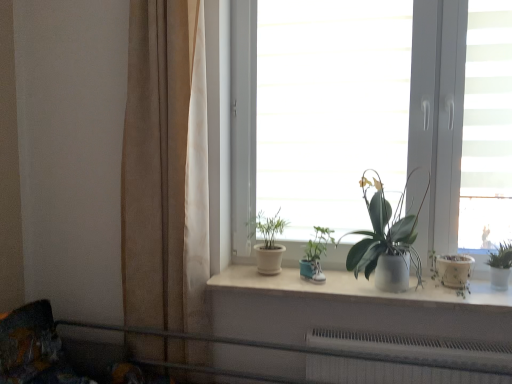
What do you see at coordinates (316, 255) in the screenshot? I see `teal fabric shoe at center, which is the 2th houseplant from left to right` at bounding box center [316, 255].

You are a GUI agent. You are given a task and a screenshot of the screen. Output one action in this format:
    pyautogui.click(x=<x>, y=<y>)
    Task: Click on the matte white pot at center, marked as the fourth houseplant in a right-to-left arrangement
    This screenshot has width=512, height=384.
    Given the screenshot: What is the action you would take?
    pyautogui.click(x=268, y=242)

What do you see at coordinates (500, 266) in the screenshot?
I see `green glossy plant at right, which ranks as the first houseplant in right-to-left order` at bounding box center [500, 266].

In order to face green glossy plant at right, which ranks as the 4th houseplant in left-to-right order, should I rotate leftwards or rightwards?

You should rotate right by 30.154 degrees.

Locate an element on the screen. This screenshot has width=512, height=384. white matte window sill at center is located at coordinates (355, 287).

What do you see at coordinates (355, 287) in the screenshot?
I see `white matte window sill at center` at bounding box center [355, 287].

I want to click on white matte window at center, so click(387, 117).

Locate an element on the screen. The width and height of the screenshot is (512, 384). teal fabric shoe at center, which is the 3th houseplant in right-to-left order is located at coordinates (316, 255).

Is white matte window at center further to camera compared to green glossy plant at right, which ranks as the 4th houseplant in left-to-right order?

That is True.

Is white matte window at center facing towards green glossy plant at right, which ranks as the 4th houseplant in left-to-right order?

Yes, white matte window at center is oriented towards green glossy plant at right, which ranks as the 4th houseplant in left-to-right order.

Can you confirm if white matte window at center is thinner than green glossy plant at right, which ranks as the first houseplant in right-to-left order?

No, white matte window at center is not thinner than green glossy plant at right, which ranks as the first houseplant in right-to-left order.

Does point (288, 17) appear closer or farther from the camera than point (499, 254)?

Point (288, 17) is farther from the camera than point (499, 254).

Is metallic gray rail at lower center taller than white matte window sill at center?

Yes.

Is point (262, 343) farther from camera compared to point (254, 282)?

No.

Based on the photo, is metallic gray rail at lower center inside or outside of white matte window sill at center?

metallic gray rail at lower center is not enclosed by white matte window sill at center.

How distant is teal fabric shoe at center, which is the 3th houseplant in right-to-left order, from white matte window sill at center?

teal fabric shoe at center, which is the 3th houseplant in right-to-left order, is 7.82 inches away from white matte window sill at center.

Is teal fabric shoe at center, which is the 3th houseplant in right-to-left order, looking in the opposite direction of white matte window sill at center?

No, white matte window sill at center is not at the back of teal fabric shoe at center, which is the 3th houseplant in right-to-left order.

Looking at this image, is the surface of teal fabric shoe at center, which is the 2th houseplant from left to right, in direct contact with white matte window sill at center?

teal fabric shoe at center, which is the 2th houseplant from left to right, and white matte window sill at center are not in contact.

Visually, is burlap curtain at left positioned to the left or to the right of green glossy plant at right, which ranks as the 4th houseplant in left-to-right order?

burlap curtain at left is positioned on green glossy plant at right, which ranks as the 4th houseplant in left-to-right order,'s left side.

Can you tell me how much burlap curtain at left and green glossy plant at right, which ranks as the 4th houseplant in left-to-right order, differ in facing direction?

0.186 degrees separate the facing orientations of burlap curtain at left and green glossy plant at right, which ranks as the 4th houseplant in left-to-right order.

Between burlap curtain at left and green glossy plant at right, which ranks as the first houseplant in right-to-left order, which one has more height?

Standing taller between the two is burlap curtain at left.

From a real-world perspective, is burlap curtain at left located higher than green glossy plant at right, which ranks as the 4th houseplant in left-to-right order?

Yes, from a real-world perspective, burlap curtain at left is above green glossy plant at right, which ranks as the 4th houseplant in left-to-right order.

Is the surface of green glossy plant at right, which ranks as the first houseplant in right-to-left order, in direct contact with white matte window sill at center?

green glossy plant at right, which ranks as the first houseplant in right-to-left order, is not next to white matte window sill at center, and they're not touching.

Relative to white matte window sill at center, is green glossy plant at right, which ranks as the first houseplant in right-to-left order, in front or behind?

green glossy plant at right, which ranks as the first houseplant in right-to-left order, is behind white matte window sill at center.

Does green glossy plant at right, which ranks as the 4th houseplant in left-to-right order, have a lesser height compared to white matte window sill at center?

Incorrect, the height of green glossy plant at right, which ranks as the 4th houseplant in left-to-right order, does not fall short of that of white matte window sill at center.

From the image's perspective, is green glossy plant at right, which ranks as the first houseplant in right-to-left order, over white matte window sill at center?

Yes.

Is green matte plant at center, acting as the 3th houseplant starting from the left, closer to camera compared to matte white pot at center, marked as the fourth houseplant in a right-to-left arrangement?

That is True.

Does point (402, 258) come farther from viewer compared to point (276, 273)?

No.

Looking at this image, is green matte plant at center, acting as the 3th houseplant starting from the left, facing away from matte white pot at center, marked as the fourth houseplant in a right-to-left arrangement?

green matte plant at center, acting as the 3th houseplant starting from the left, does not have its back to matte white pot at center, marked as the fourth houseplant in a right-to-left arrangement.

In the scene shown: Considering the relative positions of white matte window at center and matte white pot at center, marked as the fourth houseplant in a right-to-left arrangement, in the image provided, is white matte window at center behind matte white pot at center, marked as the fourth houseplant in a right-to-left arrangement,?

That is False.

From the image's perspective, which is below, white matte window at center or matte white pot at center, marked as the fourth houseplant in a right-to-left arrangement?

From the image's view, matte white pot at center, marked as the fourth houseplant in a right-to-left arrangement, is below.

The height and width of the screenshot is (384, 512). In order to click on window located in front of the matte white pot at center, which ranks as the first houseplant in left-to-right order in this screenshot , I will do `click(387, 117)`.

Is white matte window at center facing away from matte white pot at center, which ranks as the first houseplant in left-to-right order?

Yes, matte white pot at center, which ranks as the first houseplant in left-to-right order, is at the back of white matte window at center.

Identify the location of window located on the left of green glossy plant at right, which ranks as the first houseplant in right-to-left order. The width and height of the screenshot is (512, 384). coord(387,117).

This screenshot has height=384, width=512. I want to click on window sill located above the metallic gray rail at lower center (from the image's perspective), so click(355, 287).

Considering their positions, is green matte plant at center, acting as the 3th houseplant starting from the left, positioned further to metallic gray rail at lower center than matte white pot at center, marked as the fourth houseplant in a right-to-left arrangement?

Based on the image, green matte plant at center, acting as the 3th houseplant starting from the left, appears to be further to metallic gray rail at lower center.

Considering their positions, is teal fabric shoe at center, which is the 3th houseplant in right-to-left order, positioned closer to matte white pot at center, which ranks as the first houseplant in left-to-right order, than white matte window at center?

The object closer to matte white pot at center, which ranks as the first houseplant in left-to-right order, is teal fabric shoe at center, which is the 3th houseplant in right-to-left order.

From the picture: Which object lies nearer to the anchor point matte white pot at center, marked as the fourth houseplant in a right-to-left arrangement, metallic gray rail at lower center or burlap curtain at left?

Based on the image, metallic gray rail at lower center appears to be nearer to matte white pot at center, marked as the fourth houseplant in a right-to-left arrangement.

Which object lies further to the anchor point metallic gray rail at lower center, burlap curtain at left or green glossy plant at right, which ranks as the 4th houseplant in left-to-right order?

green glossy plant at right, which ranks as the 4th houseplant in left-to-right order.

Based on their spatial positions, is burlap curtain at left or matte white pot at center, marked as the fourth houseplant in a right-to-left arrangement, closer to green matte plant at center, the 2th houseplant viewed from the right?

Based on the image, matte white pot at center, marked as the fourth houseplant in a right-to-left arrangement, appears to be nearer to green matte plant at center, the 2th houseplant viewed from the right.

Based on their spatial positions, is white matte window at center or green matte plant at center, the 2th houseplant viewed from the right, closer to teal fabric shoe at center, which is the 2th houseplant from left to right?

green matte plant at center, the 2th houseplant viewed from the right, is closer to teal fabric shoe at center, which is the 2th houseplant from left to right.

Considering their positions, is matte white pot at center, which ranks as the first houseplant in left-to-right order, positioned closer to white matte window sill at center than burlap curtain at left?

Based on the image, matte white pot at center, which ranks as the first houseplant in left-to-right order, appears to be nearer to white matte window sill at center.

Which object lies further to the anchor point teal fabric shoe at center, which is the 2th houseplant from left to right, white matte window sill at center or matte white pot at center, which ranks as the first houseplant in left-to-right order?

white matte window sill at center lies further to teal fabric shoe at center, which is the 2th houseplant from left to right, than the other object.

Locate an element on the screen. window between metallic gray rail at lower center and green glossy plant at right, which ranks as the first houseplant in right-to-left order is located at coordinates (387, 117).

Where is `window sill between metallic gray rail at lower center and matte white pot at center, which ranks as the first houseplant in left-to-right order, in the front-back direction`? The image size is (512, 384). window sill between metallic gray rail at lower center and matte white pot at center, which ranks as the first houseplant in left-to-right order, in the front-back direction is located at coordinates (355, 287).

Where is `window sill situated between teal fabric shoe at center, which is the 2th houseplant from left to right, and green matte plant at center, acting as the 3th houseplant starting from the left, from left to right`? The image size is (512, 384). window sill situated between teal fabric shoe at center, which is the 2th houseplant from left to right, and green matte plant at center, acting as the 3th houseplant starting from the left, from left to right is located at coordinates (355, 287).

The width and height of the screenshot is (512, 384). I want to click on window between burlap curtain at left and green glossy plant at right, which ranks as the first houseplant in right-to-left order, in the horizontal direction, so click(x=387, y=117).